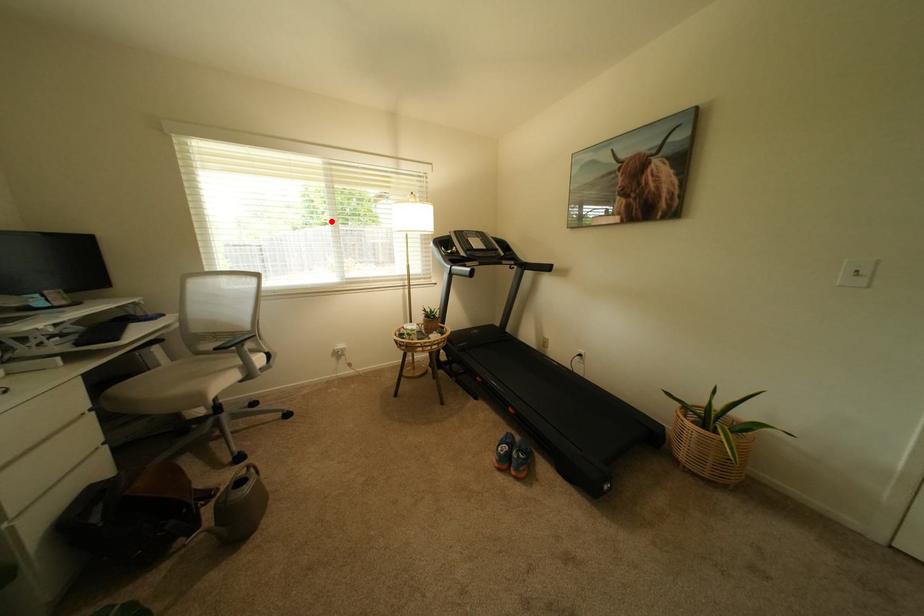
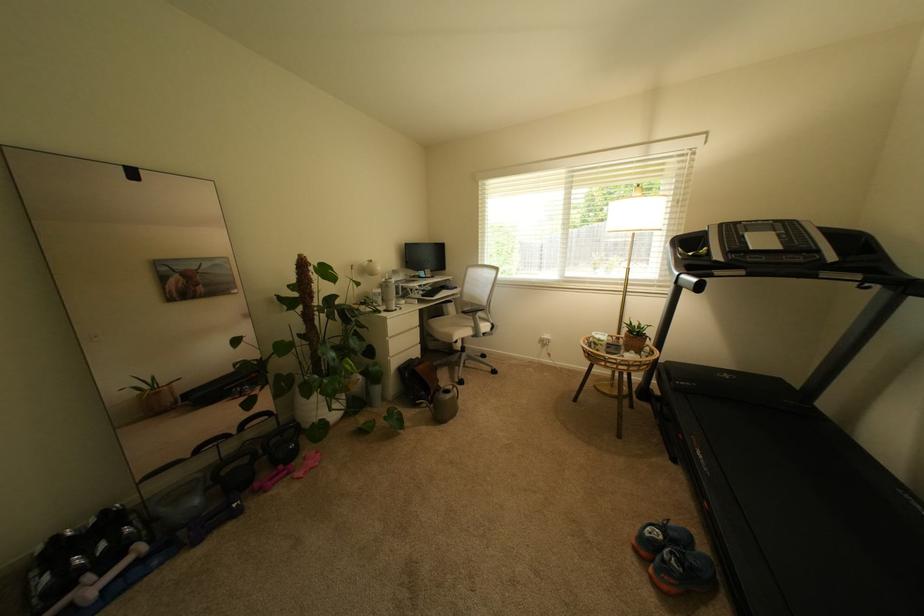
Question: I am providing you with two images of the same scene from different viewpoints. Image1 has a red point marked. In image2, the corresponding 3D location appears at what relative position? Reply with the corresponding letter.

Choices:
 (A) Closer
 (B) Farther

Answer: (A)